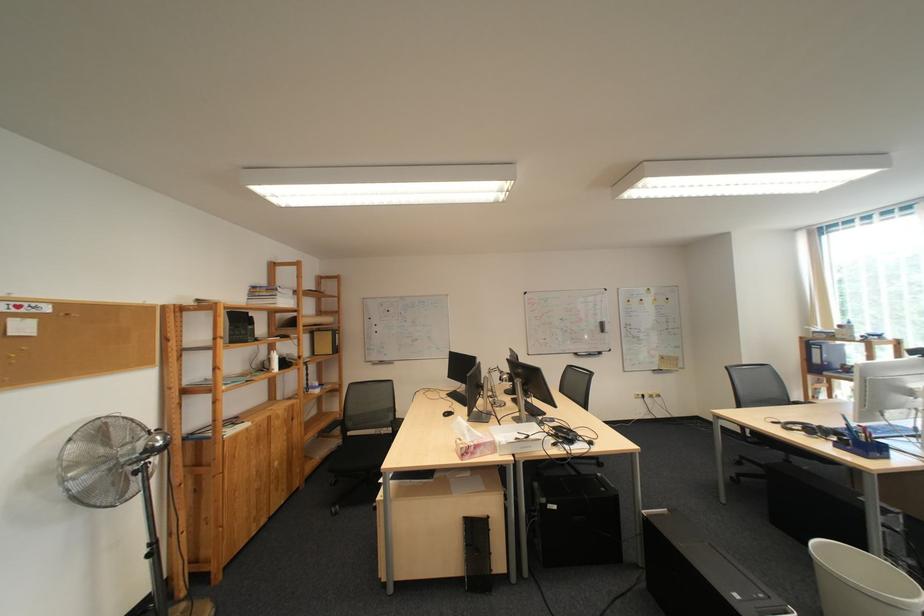
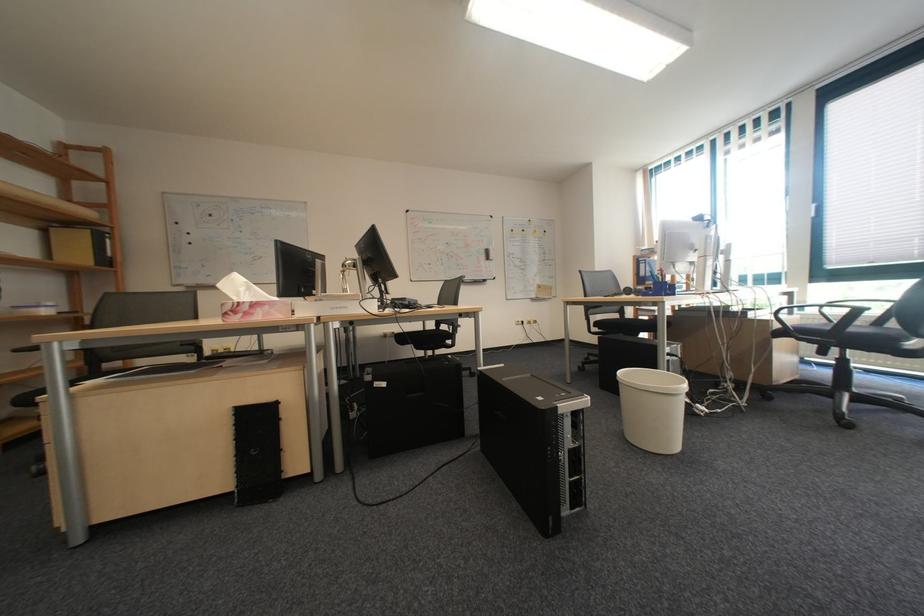
Locate, in the second image, the point that corresponds to point (569, 508) in the first image.

(398, 386)